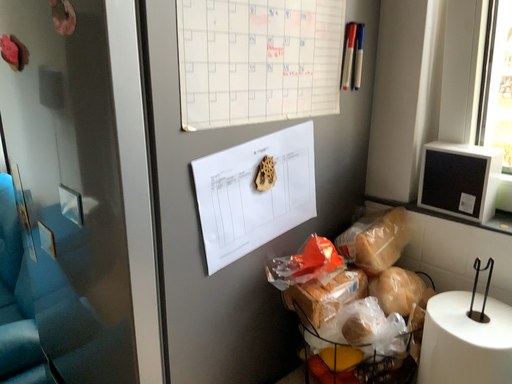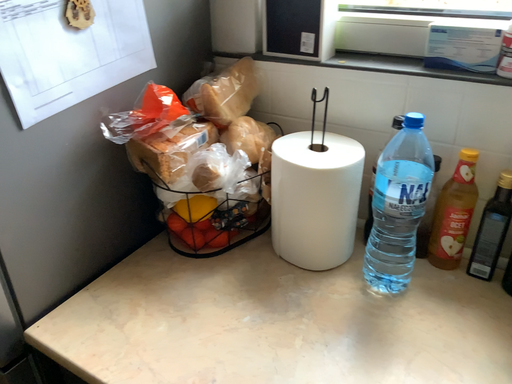
Question: Which way did the camera rotate in the video?

Choices:
 (A) rotated downward
 (B) rotated upward

Answer: (A)